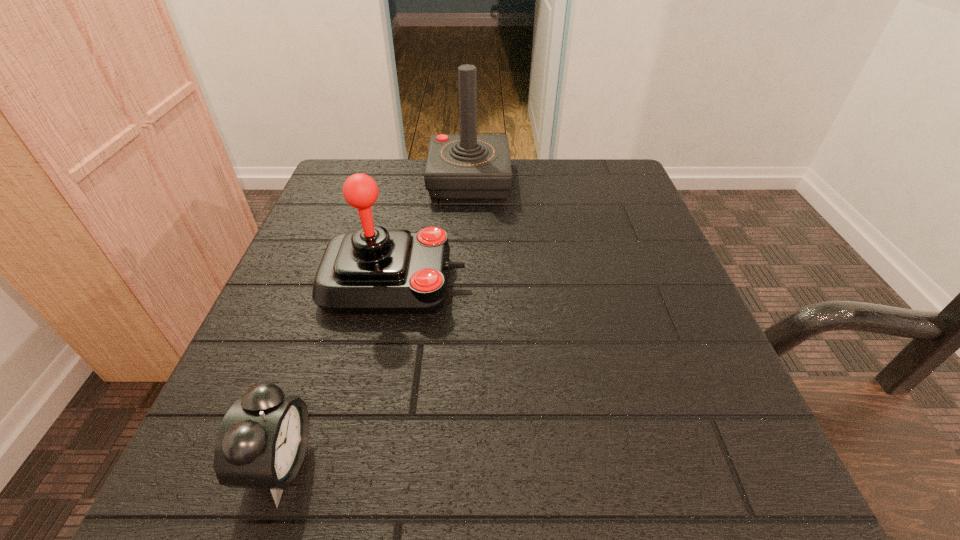
Identify the location of vacant space that satisfies the following two spatial constraints: 1. on the rectangular base of the tallest object; 2. on the base of the second farthest object. Image resolution: width=960 pixels, height=540 pixels. (466, 282).

This screenshot has height=540, width=960. In order to click on vacant space that satisfies the following two spatial constraints: 1. on the rectangular base of the tallest object; 2. on the base of the shorter joystick in this screenshot , I will do `click(466, 282)`.

I want to click on vacant space that satisfies the following two spatial constraints: 1. on the rectangular base of the farthest object; 2. on the base of the second shortest object, so pyautogui.click(x=466, y=282).

Where is `free space that satisfies the following two spatial constraints: 1. on the rectangular base of the farthest object; 2. on the front side of the shortest object`? free space that satisfies the following two spatial constraints: 1. on the rectangular base of the farthest object; 2. on the front side of the shortest object is located at coordinates (460, 463).

At what (x,y) coordinates should I click in order to perform the action: click on vacant space that satisfies the following two spatial constraints: 1. on the rectangular base of the farthest object; 2. on the front side of the nearest object. Please return your answer as a coordinate pair (x, y). Looking at the image, I should click on (460, 463).